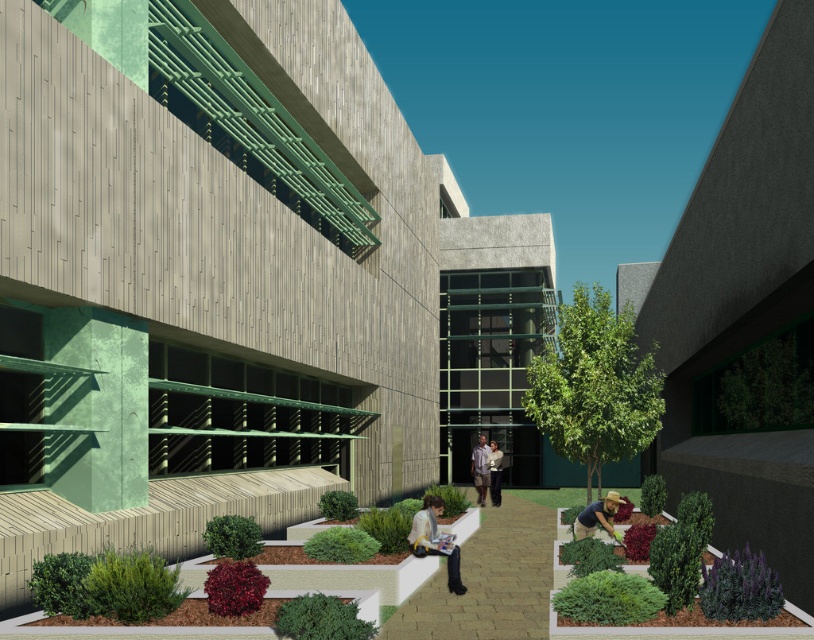
Who is positioned more to the left, light brown shirt at center or light brown leather jacket at center?

From the viewer's perspective, light brown shirt at center appears more on the left side.

Is light brown shirt at center to the right of light brown leather jacket at center from the viewer's perspective?

Incorrect, light brown shirt at center is not on the right side of light brown leather jacket at center.

I want to click on light brown shirt at center, so [x=480, y=468].

Locate an element on the screen. This screenshot has width=814, height=640. light brown shirt at center is located at coordinates (480, 468).

Locate an element on the screen. The image size is (814, 640). brown leather gloves at lower right is located at coordinates (597, 516).

Is brown leather gloves at lower right bigger than light brown shirt at center?

No.

The image size is (814, 640). In order to click on brown leather gloves at lower right in this screenshot , I will do `click(597, 516)`.

Where is `brown leather gloves at lower right`? The image size is (814, 640). brown leather gloves at lower right is located at coordinates (597, 516).

Who is positioned more to the right, yellow fabric bag at center or light brown leather jacket at center?

light brown leather jacket at center is more to the right.

Who is shorter, yellow fabric bag at center or light brown leather jacket at center?

yellow fabric bag at center is shorter.

Identify the location of yellow fabric bag at center. (435, 540).